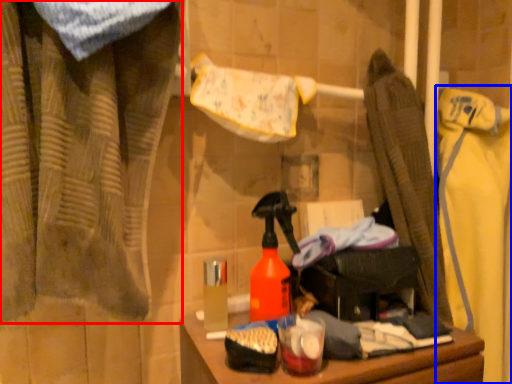
Question: Which object is further to the camera taking this photo, curtain (highlighted by a red box) or clothing (highlighted by a blue box)?

Choices:
 (A) curtain
 (B) clothing

Answer: (B)